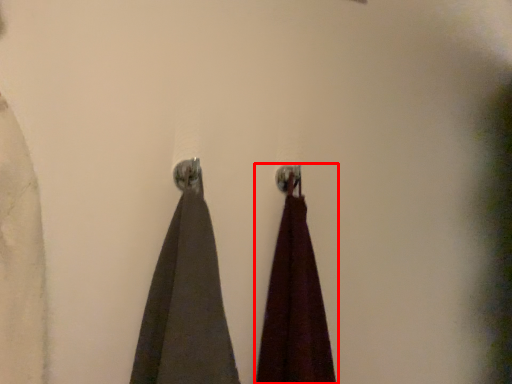
Question: Considering the relative positions of curtain (annotated by the red box) and curtain in the image provided, where is curtain (annotated by the red box) located with respect to the staircase?

Choices:
 (A) right
 (B) left

Answer: (A)